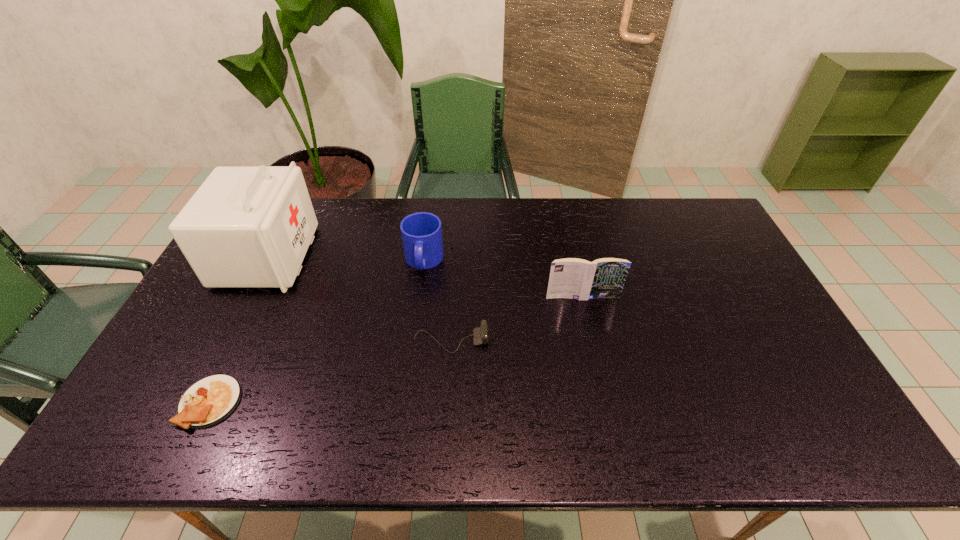
Image resolution: width=960 pixels, height=540 pixels. What are the coordinates of `unoccupied position between the tallest object and the webcam` in the screenshot? It's located at (359, 299).

Locate an element on the screen. blank region between the second shortest object and the first-aid kit is located at coordinates (359, 299).

Identify which object is located as the third nearest to the mug. Please provide its 2D coordinates. Your answer should be formatted as a tuple, i.e. [(x, y)], where the tuple contains the x and y coordinates of a point satisfying the conditions above.

[(573, 278)]

Identify the location of the second closest object to the webcam. The image size is (960, 540). (573, 278).

Locate an element on the screen. Image resolution: width=960 pixels, height=540 pixels. free space that satisfies the following two spatial constraints: 1. on the front cover of the rightmost object; 2. on the front-facing side of the fourth farthest object is located at coordinates (592, 341).

You are a GUI agent. You are given a task and a screenshot of the screen. Output one action in this format:
    pyautogui.click(x=<x>, y=<y>)
    Task: Click on the vacant space that satisfies the following two spatial constraints: 1. on the front-facing side of the tallest object; 2. on the back side of the shortest object
    
    Given the screenshot: What is the action you would take?
    pyautogui.click(x=193, y=403)